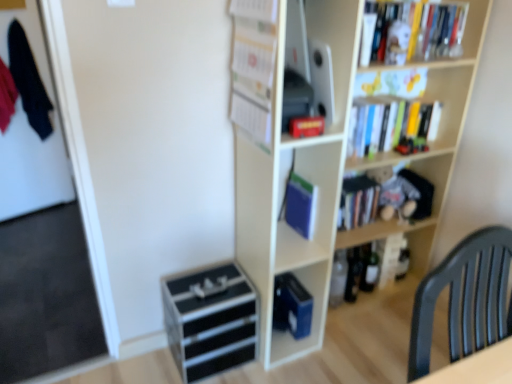
Question: Could you tell me if wooden bookcase at upper right is turned towards black glass beer bottle at lower center, positioned as the first beer bottle in left-to-right order?

Choices:
 (A) no
 (B) yes

Answer: (B)

Question: Does wooden bookcase at upper right appear on the right side of black glass beer bottle at lower center, marked as the 2th beer bottle in a right-to-left arrangement?

Choices:
 (A) yes
 (B) no

Answer: (A)

Question: From the image's perspective, would you say wooden bookcase at upper right is shown under black glass beer bottle at lower center, positioned as the first beer bottle in left-to-right order?

Choices:
 (A) yes
 (B) no

Answer: (B)

Question: Considering the relative sizes of wooden bookcase at upper right and black glass beer bottle at lower center, positioned as the first beer bottle in left-to-right order, in the image provided, is wooden bookcase at upper right shorter than black glass beer bottle at lower center, positioned as the first beer bottle in left-to-right order,?

Choices:
 (A) no
 (B) yes

Answer: (A)

Question: Does wooden bookcase at upper right appear on the left side of black glass beer bottle at lower center, positioned as the first beer bottle in left-to-right order?

Choices:
 (A) no
 (B) yes

Answer: (A)

Question: Is hardcover book at center, which is counted as the 3th book, starting from the front, spatially inside black plastic drawer at lower center, or outside of it?

Choices:
 (A) inside
 (B) outside

Answer: (B)

Question: Looking at the image, does hardcover book at center, which is the first book from back to front, seem bigger or smaller compared to black plastic drawer at lower center?

Choices:
 (A) big
 (B) small

Answer: (B)

Question: Is hardcover book at center, which ranks as the 3th book in top-to-bottom order, to the left or to the right of black plastic drawer at lower center in the image?

Choices:
 (A) right
 (B) left

Answer: (A)

Question: Looking at their shapes, would you say hardcover book at center, which ranks as the 3th book in top-to-bottom order, is wider or thinner than black plastic drawer at lower center?

Choices:
 (A) wide
 (B) thin

Answer: (B)

Question: From the image's perspective, is matte black speaker at upper center positioned above or below dark blue fabric at left?

Choices:
 (A) below
 (B) above

Answer: (A)

Question: Is point (332, 4) positioned closer to the camera than point (9, 59)?

Choices:
 (A) farther
 (B) closer

Answer: (B)

Question: Looking at the image, does matte black speaker at upper center seem bigger or smaller compared to dark blue fabric at left?

Choices:
 (A) small
 (B) big

Answer: (A)

Question: Relative to dark blue fabric at left, is matte black speaker at upper center in front or behind?

Choices:
 (A) front
 (B) behind

Answer: (A)

Question: In terms of size, does green glass bottle at lower right, which appears as the 2th beer bottle when viewed from the left, appear bigger or smaller than hardcover book at center, which is the second book from right to left?

Choices:
 (A) big
 (B) small

Answer: (B)

Question: Would you say green glass bottle at lower right, which appears as the 2th beer bottle when viewed from the left, is to the left or to the right of hardcover book at center, which is the second book from right to left, in the picture?

Choices:
 (A) right
 (B) left

Answer: (A)